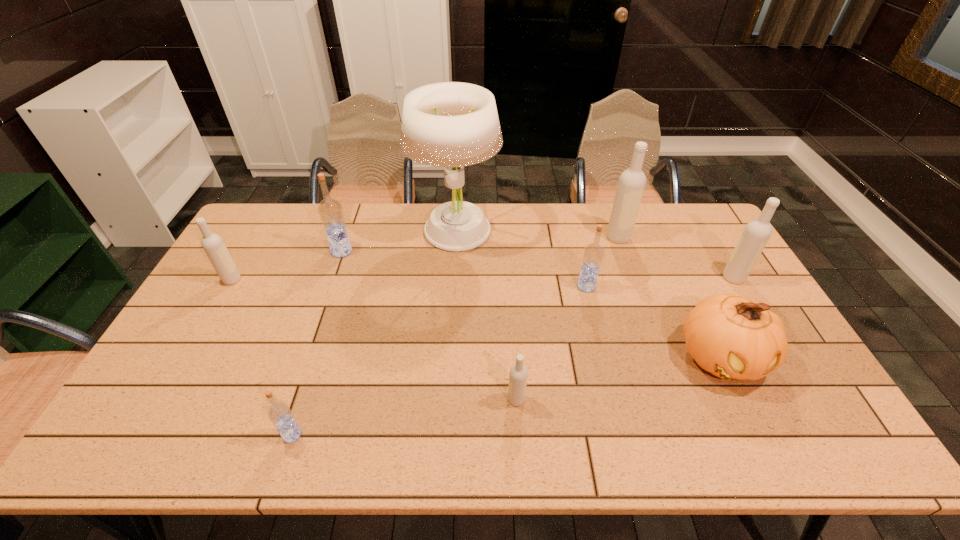
The image size is (960, 540). I want to click on empty space between the lamp and the biggest blue vodka, so click(398, 241).

Identify the location of free space between the second vodka from right to left and the tallest object. (537, 234).

The width and height of the screenshot is (960, 540). Find the location of `vacant space that is in between the second tallest object and the rightmost white vodka`. vacant space that is in between the second tallest object and the rightmost white vodka is located at coordinates (676, 258).

You are a GUI agent. You are given a task and a screenshot of the screen. Output one action in this format:
    pyautogui.click(x=<x>, y=<y>)
    Task: Click on the unoccupied area between the farthest blue vodka and the second object from right to left
    
    Given the screenshot: What is the action you would take?
    pyautogui.click(x=532, y=304)

You are a GUI agent. You are given a task and a screenshot of the screen. Output one action in this format:
    pyautogui.click(x=<x>, y=<y>)
    Task: Click on the vacant space in between the nearest vodka and the pumpkin
    
    Given the screenshot: What is the action you would take?
    pyautogui.click(x=507, y=396)

Identify which object is located as the sixth nearest to the white lamp. Please provide its 2D coordinates. Your answer should be formatted as a tuple, i.e. [(x, y)], where the tuple contains the x and y coordinates of a point satisfying the conditions above.

[(732, 337)]

Locate which object ranks second in proximity to the farthest blue vodka. Please provide its 2D coordinates. Your answer should be formatted as a tuple, i.e. [(x, y)], where the tuple contains the x and y coordinates of a point satisfying the conditions above.

[(213, 245)]

At what (x,y) coordinates should I click in order to perform the action: click on vodka object that ranks as the fifth closest to the tallest vodka. Please return your answer as a coordinate pair (x, y). Looking at the image, I should click on (279, 412).

What are the coordinates of `vodka that is the sixth nearest to the second white vodka from left to right` in the screenshot? It's located at (213, 245).

Locate an element on the screen. This screenshot has width=960, height=540. the closest white vodka to the rightmost white vodka is located at coordinates (632, 181).